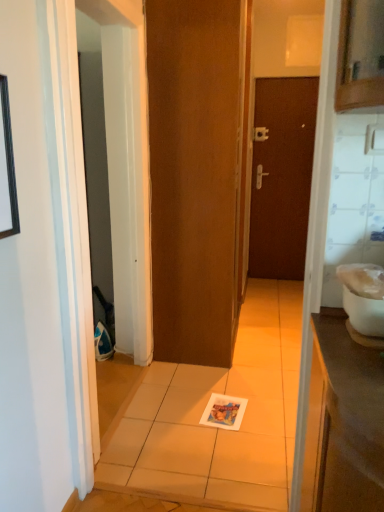
Question: Does brown matte door at center, the first door positioned from the left, appear on the left side of brown matte door at center, the 2th door in the front-to-back sequence?

Choices:
 (A) yes
 (B) no

Answer: (A)

Question: Considering the relative sizes of brown matte door at center, which is the second door from right to left, and brown matte door at center, placed as the 1th door when sorted from right to left, in the image provided, is brown matte door at center, which is the second door from right to left, taller than brown matte door at center, placed as the 1th door when sorted from right to left,?

Choices:
 (A) no
 (B) yes

Answer: (B)

Question: Is the surface of brown matte door at center, the first door positioned from the left, in direct contact with brown matte door at center, arranged as the second door when viewed from the left?

Choices:
 (A) yes
 (B) no

Answer: (B)

Question: Does brown matte door at center, the first door in the front-to-back sequence, come behind brown matte door at center, placed as the 1th door when sorted from back to front?

Choices:
 (A) no
 (B) yes

Answer: (A)

Question: From the image's perspective, is brown matte door at center, the first door positioned from the left, located above brown matte door at center, placed as the 1th door when sorted from back to front?

Choices:
 (A) no
 (B) yes

Answer: (A)

Question: From the image's perspective, does brown matte door at center, the first door positioned from the left, appear lower than brown matte door at center, the 2th door in the front-to-back sequence?

Choices:
 (A) yes
 (B) no

Answer: (A)

Question: Is brown matte door at center, placed as the 1th door when sorted from back to front, surrounding white glossy toilet bowl at right?

Choices:
 (A) yes
 (B) no

Answer: (B)

Question: From a real-world perspective, is brown matte door at center, arranged as the second door when viewed from the left, beneath white glossy toilet bowl at right?

Choices:
 (A) no
 (B) yes

Answer: (A)

Question: Can you confirm if brown matte door at center, placed as the 1th door when sorted from right to left, is thinner than white glossy toilet bowl at right?

Choices:
 (A) no
 (B) yes

Answer: (B)

Question: Is brown matte door at center, placed as the 1th door when sorted from right to left, not near white glossy toilet bowl at right?

Choices:
 (A) yes
 (B) no

Answer: (A)

Question: Does brown matte door at center, arranged as the second door when viewed from the left, lie behind white glossy toilet bowl at right?

Choices:
 (A) yes
 (B) no

Answer: (A)

Question: Is brown matte door at center, the 2th door in the front-to-back sequence, completely or partially outside of white glossy toilet bowl at right?

Choices:
 (A) yes
 (B) no

Answer: (A)

Question: Does black matte picture frame at upper left have a smaller size compared to silver metallic door handle at center?

Choices:
 (A) no
 (B) yes

Answer: (A)